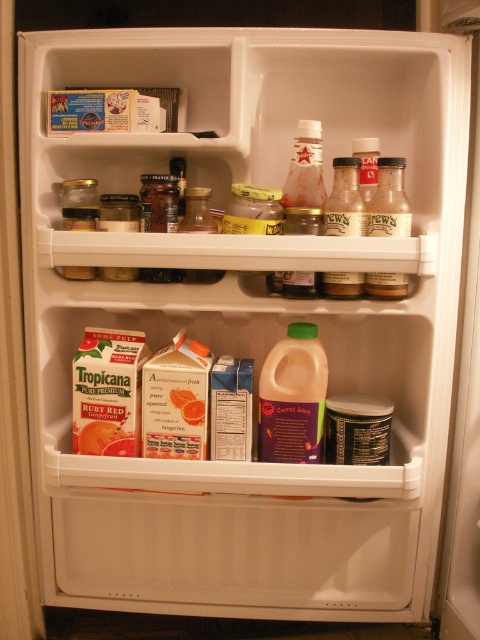
From the picture: You are organizing the contents of the refrigerator and need to place a new item between the translucent plastic jar of carrot juice at lower center and the translucent glass bottle at upper right. Based on their positions, where should you place the new item?

The new item should be placed to the right of the translucent plastic jar of carrot juice at lower center and to the left of the translucent glass bottle at upper right since the jar is positioned to the left of the bottle.

You are trying to reach for the translucent plastic jar of carrot juice at lower center inside the open refrigerator. Based on the coordinates provided, can you confirm if your hand will touch the point at (292, 397) when reaching for it?

The point at (292, 397) is on the translucent plastic jar of carrot juice at lower center, so yes, your hand will touch that point when reaching for it.